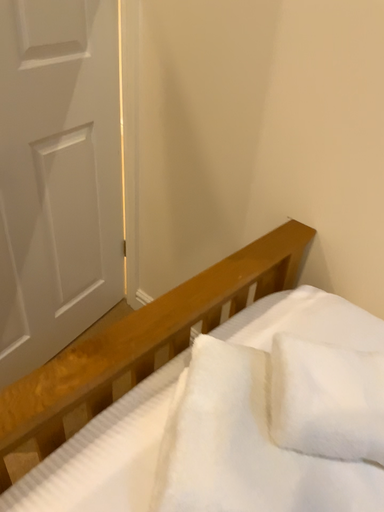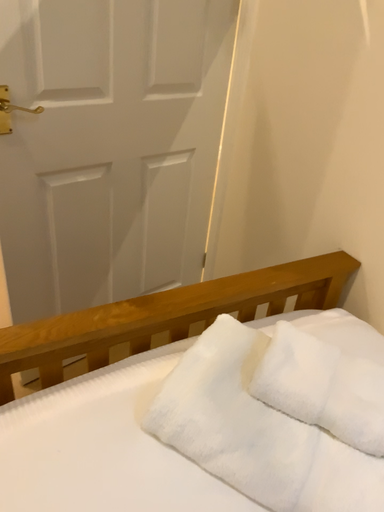
Question: How did the camera likely rotate when shooting the video?

Choices:
 (A) rotated left
 (B) rotated right

Answer: (A)